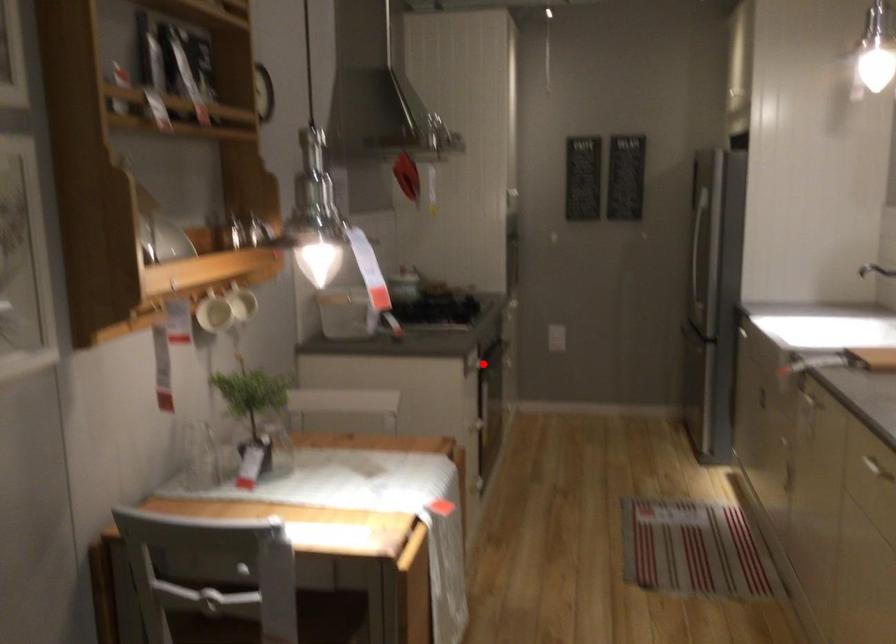
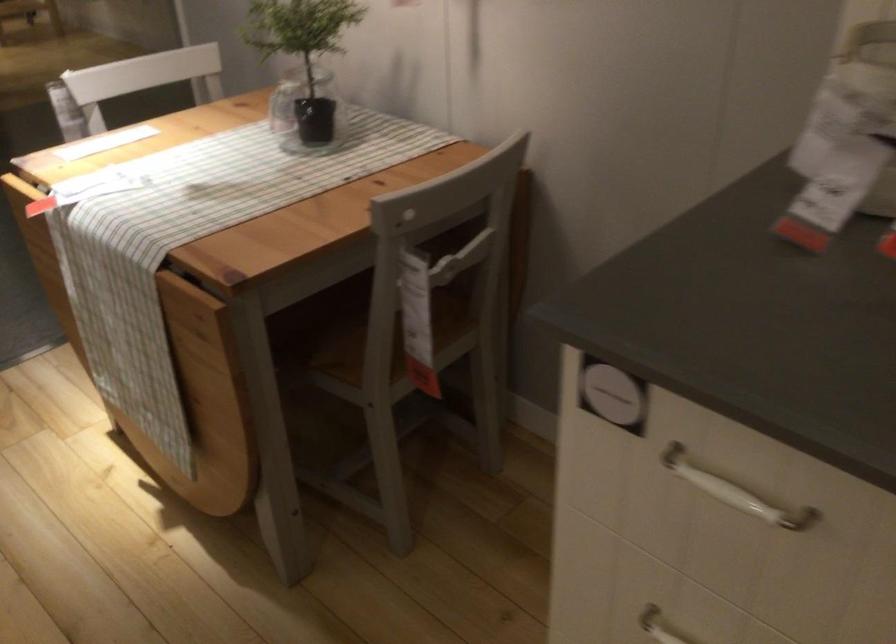
Question: I am providing you with two images of the same scene from different viewpoints. Image1 has a red point marked. In image2, the corresponding 3D location appears at what relative position? Reply with the corresponding letter.

Choices:
 (A) Closer
 (B) Farther

Answer: (A)